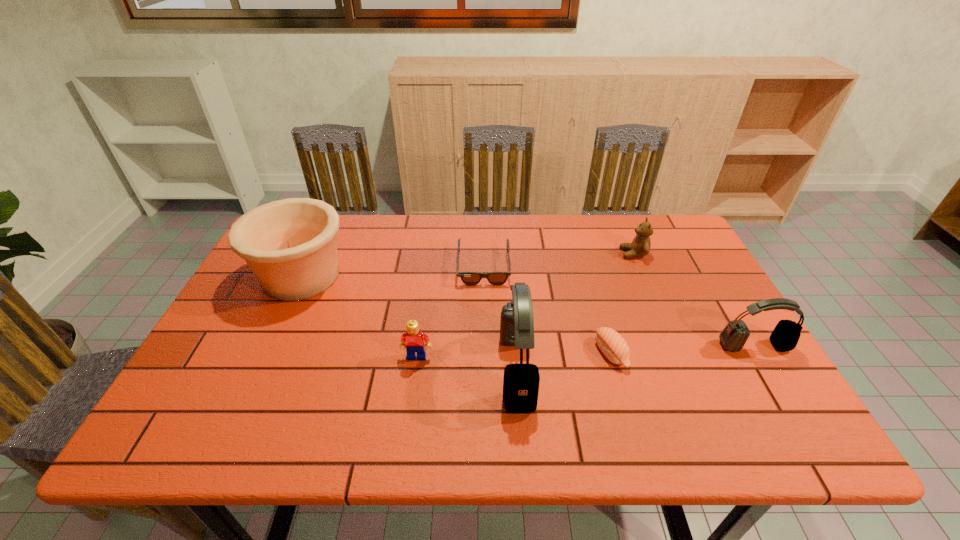
Where is `vacant point located between the shorter headset and the shortest object`? vacant point located between the shorter headset and the shortest object is located at coordinates (619, 307).

The height and width of the screenshot is (540, 960). Identify the location of free space that is in between the rightmost object and the Lego. (586, 352).

In order to click on unoccupied area between the second object from left to right and the fifth object from left to right in this screenshot , I will do `click(514, 355)`.

This screenshot has height=540, width=960. In order to click on free spot between the Lego and the shorter headset in this screenshot , I will do `click(586, 352)`.

The image size is (960, 540). In order to click on object that is the fifth nearest to the taller headset in this screenshot , I will do `click(290, 245)`.

I want to click on object that stands as the closest to the fifth object from left to right, so click(x=521, y=381).

Find the location of a particular element. Image resolution: width=960 pixels, height=540 pixels. free spot that satisfies the following two spatial constraints: 1. on the front-facing side of the sixth object from left to right; 2. on the temples of the sunglasses is located at coordinates (639, 268).

Identify the location of blank space that satisfies the following two spatial constraints: 1. on the front-facing side of the teddy bear; 2. on the front-facing side of the second object from left to right. (678, 357).